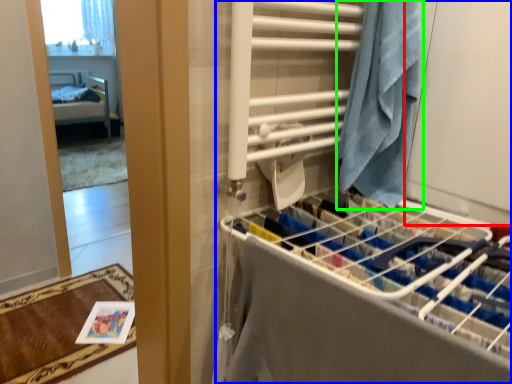
Question: Which object is positioned closest to screen door (highlighted by a red box)? Select from closet (highlighted by a blue box) and beach towel (highlighted by a green box).

Choices:
 (A) closet
 (B) beach towel

Answer: (B)